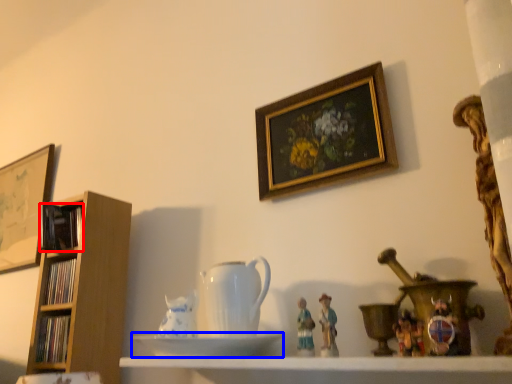
Question: Which point is further to the camera, book (highlighted by a red box) or saucer (highlighted by a blue box)?

Choices:
 (A) book
 (B) saucer

Answer: (A)